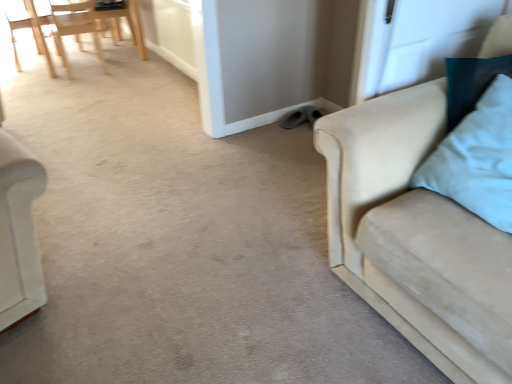
Describe the element at coordinates (415, 236) in the screenshot. I see `suede beige couch at right` at that location.

The height and width of the screenshot is (384, 512). What do you see at coordinates (75, 29) in the screenshot?
I see `light wood chair at upper left, arranged as the first chair when viewed from the right` at bounding box center [75, 29].

I want to click on white glossy screen door at upper right, so click(x=422, y=39).

What are the coordinates of `light wood chair at upper left, arranged as the first chair when viewed from the left` in the screenshot? It's located at (32, 30).

Who is bigger, white glossy screen door at upper right or light wood chair at upper left, arranged as the second chair when viewed from the left?

With larger size is light wood chair at upper left, arranged as the second chair when viewed from the left.

From a real-world perspective, which object stands above the other?

In real-world perspective, white glossy screen door at upper right is above.

Which object is positioned more to the right, white glossy screen door at upper right or light wood chair at upper left, arranged as the second chair when viewed from the left?

white glossy screen door at upper right.

Locate an element on the screen. The image size is (512, 384). the 2nd chair behind when counting from the suede beige couch at right is located at coordinates (69, 23).

Is suede beige couch at right in front of or behind light wood chair at upper left, arranged as the second chair when viewed from the left, in the image?

Visually, suede beige couch at right is located in front of light wood chair at upper left, arranged as the second chair when viewed from the left.

Is light wood chair at upper left, arranged as the second chair when viewed from the left, at the back of suede beige couch at right?

That's not correct — suede beige couch at right is not looking away from light wood chair at upper left, arranged as the second chair when viewed from the left.

In the scene shown: From a real-world perspective, which is physically above, suede beige couch at right or light wood chair at upper left, the 2th chair in the right-to-left sequence?

In real-world perspective, suede beige couch at right is above.

Visually, is suede beige couch at right positioned to the left or to the right of white glossy screen door at upper right?

Based on their positions, suede beige couch at right is located to the right of white glossy screen door at upper right.

Can you confirm if suede beige couch at right is shorter than white glossy screen door at upper right?

In fact, suede beige couch at right may be taller than white glossy screen door at upper right.

From a real-world perspective, which is physically below, suede beige couch at right or white glossy screen door at upper right?

From a 3D spatial view, suede beige couch at right is below.

Which object is thinner, suede beige couch at right or white glossy screen door at upper right?

white glossy screen door at upper right is thinner.

What are the coordinates of `the 1st chair counting from the left of the gray suede shoes at center` in the screenshot? It's located at (75, 29).

Is light wood chair at upper left, the third chair positioned from the left, to the right of gray suede shoes at center from the viewer's perspective?

No, light wood chair at upper left, the third chair positioned from the left, is not to the right of gray suede shoes at center.

Considering the relative sizes of light wood chair at upper left, arranged as the first chair when viewed from the right, and gray suede shoes at center in the image provided, is light wood chair at upper left, arranged as the first chair when viewed from the right, wider than gray suede shoes at center?

Indeed, light wood chair at upper left, arranged as the first chair when viewed from the right, has a greater width compared to gray suede shoes at center.

Is light wood chair at upper left, the third chair positioned from the left, next to gray suede shoes at center?

There is a gap between light wood chair at upper left, the third chair positioned from the left, and gray suede shoes at center.

Is the depth of light wood chair at upper left, the 2th chair in the right-to-left sequence, greater than that of light blue fabric pillow at right?

Yes, the depth of light wood chair at upper left, the 2th chair in the right-to-left sequence, is greater than that of light blue fabric pillow at right.

From a real-world perspective, relative to light blue fabric pillow at right, is light wood chair at upper left, arranged as the second chair when viewed from the left, vertically above or below?

Clearly, from a real-world perspective, light wood chair at upper left, arranged as the second chair when viewed from the left, is below light blue fabric pillow at right.

Which is closer to the camera, (136, 0) or (510, 90)?

Point (136, 0) is farther from the camera than point (510, 90).

This screenshot has width=512, height=384. In order to click on pillow above the light wood chair at upper left, arranged as the second chair when viewed from the left (from a real-world perspective) in this screenshot , I will do `click(477, 158)`.

Looking at this image, from the image's perspective, which one is positioned lower, light wood chair at upper left, arranged as the first chair when viewed from the left, or light wood chair at upper left, the 2th chair in the right-to-left sequence?

light wood chair at upper left, arranged as the first chair when viewed from the left.

Find the location of a particular element. Image resolution: width=512 pixels, height=384 pixels. chair above the light wood chair at upper left, the third chair viewed from the right (from the image's perspective) is located at coordinates (69, 23).

Can you tell me how much light wood chair at upper left, the third chair viewed from the right, and light wood chair at upper left, arranged as the second chair when viewed from the left, differ in facing direction?

The angle between the facing direction of light wood chair at upper left, the third chair viewed from the right, and the facing direction of light wood chair at upper left, arranged as the second chair when viewed from the left, is 178 degrees.

Is light wood chair at upper left, arranged as the first chair when viewed from the left, aimed at light wood chair at upper left, the 2th chair in the right-to-left sequence?

Yes, light wood chair at upper left, arranged as the first chair when viewed from the left, faces towards light wood chair at upper left, the 2th chair in the right-to-left sequence.

Can you confirm if light blue fabric pillow at right is positioned to the right of suede beige couch at right?

Yes, light blue fabric pillow at right is to the right of suede beige couch at right.

From the picture: From the image's perspective, which one is positioned lower, light blue fabric pillow at right or suede beige couch at right?

suede beige couch at right, from the image's perspective.

Is light blue fabric pillow at right not near suede beige couch at right?

No, there isn't a large distance between light blue fabric pillow at right and suede beige couch at right.

Is point (446, 181) farther from viewer compared to point (325, 158)?

No, it is not.

Starting from the white glossy screen door at upper right, which chair is the 2nd one behind? Please provide its 2D coordinates.

[(69, 23)]

Starting from the suede beige couch at right, which chair is the 2nd one to the left? Please provide its 2D coordinates.

[(69, 23)]

Which object lies further to the anchor point white glossy screen door at upper right, light wood chair at upper left, arranged as the second chair when viewed from the left, or suede beige couch at right?

Based on the image, light wood chair at upper left, arranged as the second chair when viewed from the left, appears to be further to white glossy screen door at upper right.

Which object lies further to the anchor point light wood chair at upper left, arranged as the first chair when viewed from the left, light wood chair at upper left, the 2th chair in the right-to-left sequence, or light wood chair at upper left, the third chair positioned from the left?

light wood chair at upper left, the third chair positioned from the left.

Which object lies further to the anchor point light wood chair at upper left, arranged as the first chair when viewed from the right, white glossy screen door at upper right or light wood chair at upper left, the third chair viewed from the right?

The object further to light wood chair at upper left, arranged as the first chair when viewed from the right, is white glossy screen door at upper right.

When comparing their distances from light blue fabric pillow at right, does gray suede shoes at center or suede beige couch at right seem closer?

The object closer to light blue fabric pillow at right is suede beige couch at right.

Based on the photo, estimate the real-world distances between objects in this image. Which object is closer to suede beige couch at right, gray suede shoes at center or light wood chair at upper left, the 2th chair in the right-to-left sequence?

Based on the image, gray suede shoes at center appears to be nearer to suede beige couch at right.

Estimate the real-world distances between objects in this image. Which object is closer to suede beige couch at right, gray suede shoes at center or white glossy screen door at upper right?

white glossy screen door at upper right is positioned closer to the anchor suede beige couch at right.

From the image, which object appears to be farther from light wood chair at upper left, the 2th chair in the right-to-left sequence, light wood chair at upper left, arranged as the first chair when viewed from the left, or light wood chair at upper left, arranged as the first chair when viewed from the right?

light wood chair at upper left, arranged as the first chair when viewed from the left, is further to light wood chair at upper left, the 2th chair in the right-to-left sequence.

Which object lies further to the anchor point light wood chair at upper left, the third chair viewed from the right, gray suede shoes at center or white glossy screen door at upper right?

white glossy screen door at upper right is further to light wood chair at upper left, the third chair viewed from the right.

What are the coordinates of `pillow located between suede beige couch at right and gray suede shoes at center in the depth direction` in the screenshot? It's located at (477, 158).

Where is `footwear positioned between suede beige couch at right and light wood chair at upper left, the third chair positioned from the left, from near to far`? The width and height of the screenshot is (512, 384). footwear positioned between suede beige couch at right and light wood chair at upper left, the third chair positioned from the left, from near to far is located at coordinates (301, 117).

Where is `screen door between light wood chair at upper left, arranged as the first chair when viewed from the right, and light blue fabric pillow at right`? This screenshot has width=512, height=384. screen door between light wood chair at upper left, arranged as the first chair when viewed from the right, and light blue fabric pillow at right is located at coordinates (422, 39).

Locate an element on the screen. This screenshot has width=512, height=384. footwear between light wood chair at upper left, the 2th chair in the right-to-left sequence, and white glossy screen door at upper right is located at coordinates (301, 117).